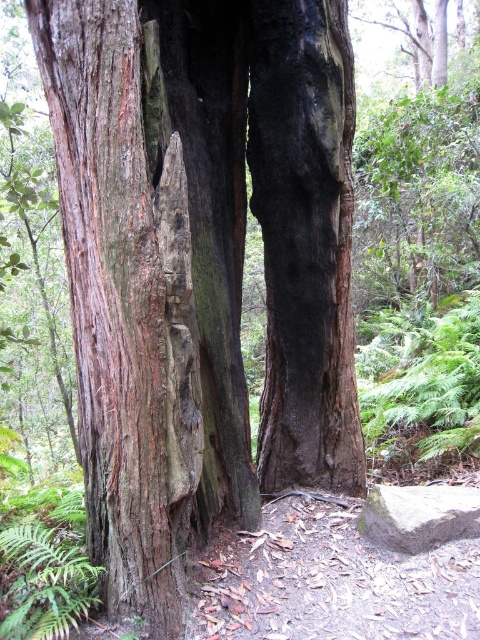
You are standing in front of the tree trunk and notice two marks on the bark. The first mark is at point [171,573] and the second is at point [389,518]. Which mark is closer to you?

Point [171,573] is closer to the viewer than point [389,518].

You are a hiker who wants to place a small backpack on a stable surface. Based on the scene, which object between the rough bark tree trunk at center and the gray smooth rock at lower right would be more suitable for placing your backpack?

The gray smooth rock at lower right is more suitable for placing the backpack because the rough bark tree trunk at center is located above it, implying the rock is a solid surface at ground level.

You are standing in a forest and see a large tree trunk with a split. There is a point marked at coordinates point (167,444) on the trunk. If you want to place a small sensor device that requires being 8 feet away from the point to avoid interference, will your current position be safe?

The distance between point (167,444) and the viewer is 7.87 feet. Since the required distance is 8 feet, your current position is slightly too close. Move back about 0.13 feet to ensure safety.